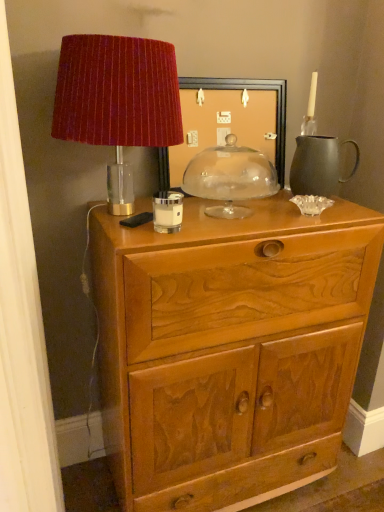
The height and width of the screenshot is (512, 384). I want to click on vacant space in front of matte black pitcher at right, so click(x=333, y=212).